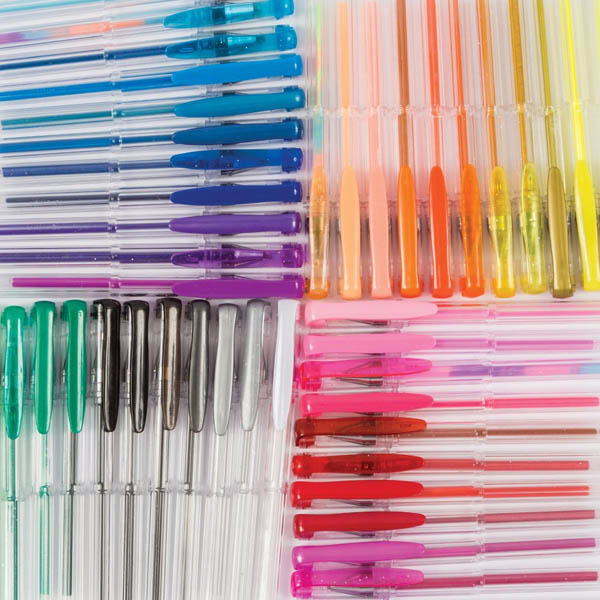
Find the location of a particular element. pens with caps facing right is located at coordinates (208, 15), (225, 39), (228, 70), (228, 103), (230, 125), (230, 158), (236, 195), (235, 219), (236, 250), (237, 286).